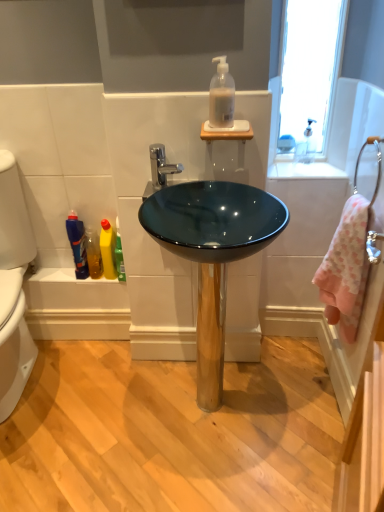
What is the approximate width of clear glass faucet at upper right?

2.71 inches.

The image size is (384, 512). What do you see at coordinates (108, 249) in the screenshot?
I see `yellow plastic bottle at lower left, which is the first cleaning product from back to front` at bounding box center [108, 249].

What is the approximate width of yellow plastic bottle at lower left, which is the first cleaning product from back to front?

It is 4.68 inches.

In order to face glossy glass bowl at center, should I rotate leftwards or rightwards?

It's best to rotate right around 1.621 degrees.

Where is `pink terry cloth towel at right`? pink terry cloth towel at right is located at coordinates (347, 266).

How different are the orientations of pink terry cloth towel at right and clear glass faucet at upper right in degrees?

90.2 degrees separate the facing orientations of pink terry cloth towel at right and clear glass faucet at upper right.

From a real-world perspective, is pink terry cloth towel at right located higher than clear glass faucet at upper right?

Incorrect, from a real-world perspective, pink terry cloth towel at right is lower than clear glass faucet at upper right.

Between pink terry cloth towel at right and clear glass faucet at upper right, which one has more height?

pink terry cloth towel at right is taller.

Which object is further away from the camera taking this photo, pink terry cloth towel at right or clear glass faucet at upper right?

clear glass faucet at upper right is further away from the camera.

Is glossy glass bowl at center to the right of translucent plastic soap dispenser at upper center, arranged as the first cleaning product when viewed from the front, from the viewer's perspective?

No.

Does glossy glass bowl at center have a larger size compared to translucent plastic soap dispenser at upper center, the first cleaning product positioned from the top?

Correct, glossy glass bowl at center is larger in size than translucent plastic soap dispenser at upper center, the first cleaning product positioned from the top.

Between glossy glass bowl at center and translucent plastic soap dispenser at upper center, arranged as the first cleaning product when viewed from the front, which one has more height?

Standing taller between the two is glossy glass bowl at center.

Which is in front, point (206, 288) or point (232, 102)?

The point (232, 102) is in front.

Based on the photo, is translucent plastic soap dispenser at upper center, marked as the second cleaning product in a left-to-right arrangement, oriented away from white glossy countertop at upper right?

No, translucent plastic soap dispenser at upper center, marked as the second cleaning product in a left-to-right arrangement,'s orientation is not away from white glossy countertop at upper right.

From a real-world perspective, is translucent plastic soap dispenser at upper center, marked as the second cleaning product in a left-to-right arrangement, beneath white glossy countertop at upper right?

No, from a real-world perspective, translucent plastic soap dispenser at upper center, marked as the second cleaning product in a left-to-right arrangement, is not below white glossy countertop at upper right.

Is translucent plastic soap dispenser at upper center, the 2th cleaning product in the bottom-to-top sequence, to the left of white glossy countertop at upper right from the viewer's perspective?

Yes, translucent plastic soap dispenser at upper center, the 2th cleaning product in the bottom-to-top sequence, is to the left of white glossy countertop at upper right.

Can you confirm if translucent plastic soap dispenser at upper center, the first cleaning product positioned from the top, is shorter than white glossy countertop at upper right?

Incorrect, the height of translucent plastic soap dispenser at upper center, the first cleaning product positioned from the top, does not fall short of that of white glossy countertop at upper right.

Does blue glossy mouthwash at lower left come behind translucent plastic soap dispenser at upper center, the 2th cleaning product in the back-to-front sequence?

Yes, it is behind translucent plastic soap dispenser at upper center, the 2th cleaning product in the back-to-front sequence.

At what (x,y) coordinates should I click in order to perform the action: click on mouthwash on the left of translucent plastic soap dispenser at upper center, arranged as the first cleaning product when viewed from the front. Please return your answer as a coordinate pair (x, y). The height and width of the screenshot is (512, 384). Looking at the image, I should click on (77, 244).

Can you confirm if blue glossy mouthwash at lower left is taller than translucent plastic soap dispenser at upper center, arranged as the first cleaning product when viewed from the front?

Indeed, blue glossy mouthwash at lower left has a greater height compared to translucent plastic soap dispenser at upper center, arranged as the first cleaning product when viewed from the front.

What's the angular difference between chrome metallic faucet at center and blue glossy mouthwash at lower left's facing directions?

There is a 2.01-degree angle between the facing directions of chrome metallic faucet at center and blue glossy mouthwash at lower left.

In the scene shown: From the image's perspective, would you say chrome metallic faucet at center is positioned over blue glossy mouthwash at lower left?

Yes, from the image's perspective, chrome metallic faucet at center is over blue glossy mouthwash at lower left.

Consider the image. Is chrome metallic faucet at center facing towards blue glossy mouthwash at lower left?

No, chrome metallic faucet at center is not turned towards blue glossy mouthwash at lower left.

From a real-world perspective, which object stands above the other?

chrome metallic faucet at center.

Does chrome metallic faucet at center have a lesser width compared to white glossy countertop at upper right?

Yes, chrome metallic faucet at center is thinner than white glossy countertop at upper right.

Would you say chrome metallic faucet at center is outside white glossy countertop at upper right?

Yes, chrome metallic faucet at center is outside of white glossy countertop at upper right.

Considering the sizes of chrome metallic faucet at center and white glossy countertop at upper right in the image, is chrome metallic faucet at center taller or shorter than white glossy countertop at upper right?

Considering their sizes, chrome metallic faucet at center has more height than white glossy countertop at upper right.

Considering the relative sizes of translucent yellow liquid at lower left and white glossy countertop at upper right in the image provided, is translucent yellow liquid at lower left bigger than white glossy countertop at upper right?

Actually, translucent yellow liquid at lower left might be smaller than white glossy countertop at upper right.

Which is behind, point (86, 247) or point (296, 170)?

Positioned behind is point (86, 247).

From a real-world perspective, is translucent yellow liquid at lower left under white glossy countertop at upper right?

Correct, in the physical world, translucent yellow liquid at lower left is lower than white glossy countertop at upper right.

Identify the location of faucet behind the pink terry cloth towel at right. (306, 145).

The image size is (384, 512). Identify the location of sink that is below the translucent plastic soap dispenser at upper center, the first cleaning product positioned from the top (from the image's perspective). (212, 254).

Based on their spatial positions, is silver metallic towel bar at right or glossy glass bowl at center further from translucent plastic soap dispenser at upper center, the first cleaning product positioned from the top?

glossy glass bowl at center.

When comparing their distances from clear glass faucet at upper right, does translucent plastic soap dispenser at upper center, marked as the second cleaning product in a left-to-right arrangement, or white glossy countertop at upper right seem closer?

The object closer to clear glass faucet at upper right is white glossy countertop at upper right.

From the image, which object appears to be nearer to translucent plastic soap dispenser at upper center, acting as the first cleaning product starting from the right, white glossy countertop at upper right or clear glass faucet at upper right?

Based on the image, white glossy countertop at upper right appears to be nearer to translucent plastic soap dispenser at upper center, acting as the first cleaning product starting from the right.

When comparing their distances from white glossy countertop at upper right, does clear glass faucet at upper right or silver metallic towel bar at right seem closer?

Among the two, clear glass faucet at upper right is located nearer to white glossy countertop at upper right.

From the image, which object appears to be nearer to chrome metallic faucet at center, translucent yellow liquid at lower left or translucent plastic soap dispenser at upper center, the 2th cleaning product in the bottom-to-top sequence?

translucent plastic soap dispenser at upper center, the 2th cleaning product in the bottom-to-top sequence, is positioned closer to the anchor chrome metallic faucet at center.

From the image, which object appears to be farther from glossy glass bowl at center, yellow plastic bottle at lower left, which appears as the 1th cleaning product when viewed from the left, or clear glass faucet at upper right?

clear glass faucet at upper right lies further to glossy glass bowl at center than the other object.

Looking at the image, which one is located further to glossy glass bowl at center, clear glass faucet at upper right or white glossy countertop at upper right?

clear glass faucet at upper right is positioned further to the anchor glossy glass bowl at center.

Estimate the real-world distances between objects in this image. Which object is closer to pink terry cloth towel at right, clear glass faucet at upper right or blue glossy mouthwash at lower left?

Among the two, clear glass faucet at upper right is located nearer to pink terry cloth towel at right.

Where is `toiletry between blue glossy mouthwash at lower left and yellow plastic bottle at lower left, the 2th cleaning product from the right`? This screenshot has height=512, width=384. toiletry between blue glossy mouthwash at lower left and yellow plastic bottle at lower left, the 2th cleaning product from the right is located at coordinates [x=93, y=253].

Locate an element on the screen. The image size is (384, 512). cleaning product between translucent plastic soap dispenser at upper center, the 2th cleaning product in the bottom-to-top sequence, and translucent yellow liquid at lower left, along the z-axis is located at coordinates (108, 249).

You are a GUI agent. You are given a task and a screenshot of the screen. Output one action in this format:
    pyautogui.click(x=<x>, y=<y>)
    Task: Click on the sink between translucent yellow liquid at lower left and pink terry cloth towel at right in the horizontal direction
    This screenshot has width=384, height=512.
    Given the screenshot: What is the action you would take?
    pyautogui.click(x=212, y=254)

Locate an element on the screen. Image resolution: width=384 pixels, height=512 pixels. tap between blue glossy mouthwash at lower left and clear glass faucet at upper right is located at coordinates (161, 166).